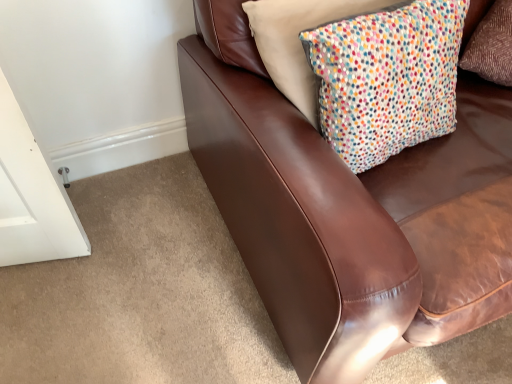
Image resolution: width=512 pixels, height=384 pixels. Describe the element at coordinates (349, 203) in the screenshot. I see `brown leather couch at upper right` at that location.

This screenshot has height=384, width=512. Identify the location of brown leather couch at upper right. (349, 203).

Find the location of `white dotted fabric pillow at upper right`. white dotted fabric pillow at upper right is located at coordinates (387, 79).

This screenshot has width=512, height=384. Describe the element at coordinates (387, 79) in the screenshot. I see `white dotted fabric pillow at upper right` at that location.

Where is `brown leather couch at upper right`? The height and width of the screenshot is (384, 512). brown leather couch at upper right is located at coordinates (349, 203).

Is white dotted fabric pillow at upper right to the right of brown leather couch at upper right from the viewer's perspective?

No, white dotted fabric pillow at upper right is not to the right of brown leather couch at upper right.

Looking at this image, is white dotted fabric pillow at upper right further to camera compared to brown leather couch at upper right?

Yes.

Which is further, (406,50) or (495,167)?

The point (495,167) is farther from the camera.

From the image's perspective, would you say white dotted fabric pillow at upper right is shown under brown leather couch at upper right?

Yes, from the image's perspective, white dotted fabric pillow at upper right is beneath brown leather couch at upper right.

From a real-world perspective, is white dotted fabric pillow at upper right beneath brown leather couch at upper right?

Incorrect, from a real-world perspective, white dotted fabric pillow at upper right is higher than brown leather couch at upper right.

Which object is wider, white dotted fabric pillow at upper right or brown leather couch at upper right?

A: With larger width is brown leather couch at upper right.

Which of these two, white dotted fabric pillow at upper right or brown leather couch at upper right, stands shorter?

Standing shorter between the two is white dotted fabric pillow at upper right.

In terms of size, does white dotted fabric pillow at upper right appear bigger or smaller than brown leather couch at upper right?

Clearly, white dotted fabric pillow at upper right is smaller in size than brown leather couch at upper right.

Is white dotted fabric pillow at upper right spatially inside brown leather couch at upper right, or outside of it?

white dotted fabric pillow at upper right is located inside brown leather couch at upper right.

Based on the photo, would you consider white dotted fabric pillow at upper right to be distant from brown leather couch at upper right?

That's not correct — white dotted fabric pillow at upper right is a little close to brown leather couch at upper right.

Is white dotted fabric pillow at upper right facing towards brown leather couch at upper right?

Yes, white dotted fabric pillow at upper right is facing brown leather couch at upper right.

Can you tell me how much white dotted fabric pillow at upper right and brown leather couch at upper right differ in facing direction?

1.55 degrees.

This screenshot has height=384, width=512. Find the location of `studio couch in front of the white dotted fabric pillow at upper right`. studio couch in front of the white dotted fabric pillow at upper right is located at coordinates (349, 203).

Based on their positions, is brown leather couch at upper right located to the left or right of white dotted fabric pillow at upper right?

brown leather couch at upper right is to the right of white dotted fabric pillow at upper right.

Is brown leather couch at upper right in front of or behind white dotted fabric pillow at upper right in the image?

brown leather couch at upper right is positioned closer to the viewer than white dotted fabric pillow at upper right.

Does point (338, 246) come in front of point (423, 119)?

Yes, point (338, 246) is in front of point (423, 119).

From the image's perspective, which object appears higher, brown leather couch at upper right or white dotted fabric pillow at upper right?

brown leather couch at upper right appears higher in the image.

From a real-world perspective, is brown leather couch at upper right physically below white dotted fabric pillow at upper right?

Yes, from a real-world perspective, brown leather couch at upper right is below white dotted fabric pillow at upper right.

Considering the relative sizes of brown leather couch at upper right and white dotted fabric pillow at upper right in the image provided, is brown leather couch at upper right wider than white dotted fabric pillow at upper right?

Correct, the width of brown leather couch at upper right exceeds that of white dotted fabric pillow at upper right.

Does brown leather couch at upper right have a lesser height compared to white dotted fabric pillow at upper right?

Incorrect, the height of brown leather couch at upper right does not fall short of that of white dotted fabric pillow at upper right.

Who is smaller, brown leather couch at upper right or white dotted fabric pillow at upper right?

Smaller between the two is white dotted fabric pillow at upper right.

Is brown leather couch at upper right situated inside white dotted fabric pillow at upper right or outside?

brown leather couch at upper right is not inside white dotted fabric pillow at upper right, it's outside.

Are brown leather couch at upper right and white dotted fabric pillow at upper right far apart?

No, there isn't a large distance between brown leather couch at upper right and white dotted fabric pillow at upper right.

Is brown leather couch at upper right turned away from white dotted fabric pillow at upper right?

Yes, brown leather couch at upper right is facing away from white dotted fabric pillow at upper right.

Measure the distance between brown leather couch at upper right and white dotted fabric pillow at upper right.

brown leather couch at upper right and white dotted fabric pillow at upper right are 7.92 inches apart.

Where is `pillow behind the brown leather couch at upper right`? The height and width of the screenshot is (384, 512). pillow behind the brown leather couch at upper right is located at coordinates (387, 79).

At what (x,y) coordinates should I click in order to perform the action: click on pillow above the brown leather couch at upper right (from a real-world perspective). Please return your answer as a coordinate pair (x, y). This screenshot has width=512, height=384. Looking at the image, I should click on (x=387, y=79).

The image size is (512, 384). Identify the location of studio couch that is above the white dotted fabric pillow at upper right (from the image's perspective). (349, 203).